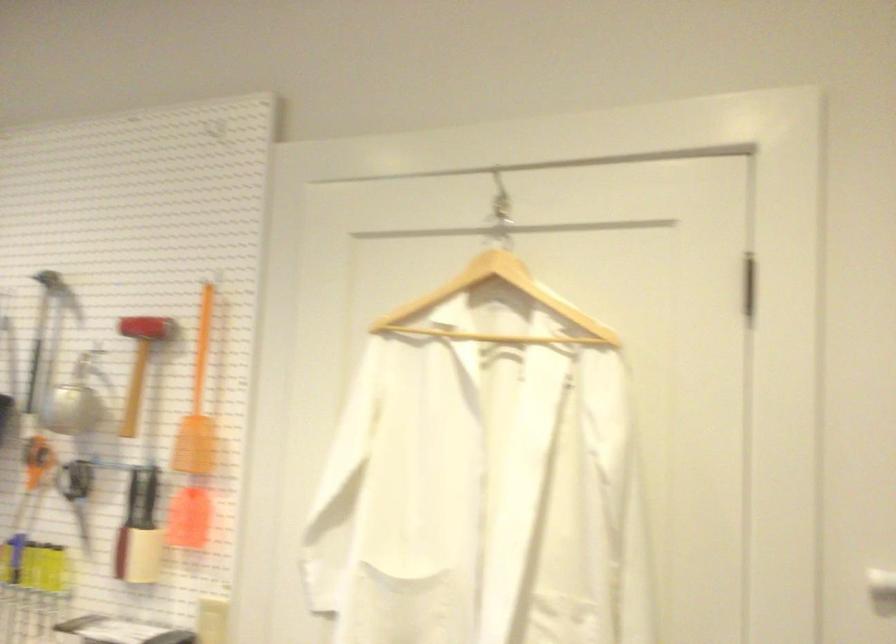
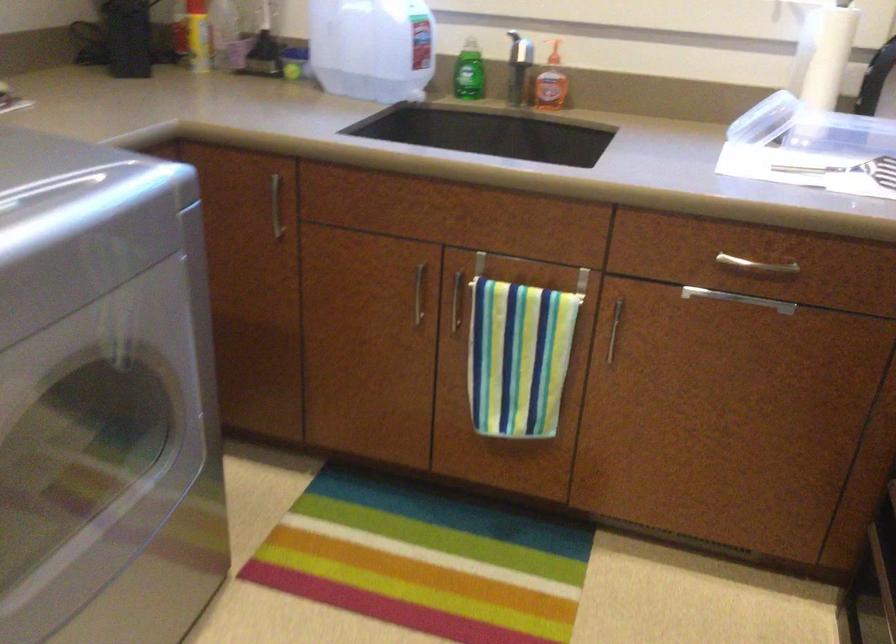
The images are taken continuously from a first-person perspective. In which direction is your viewpoint rotating?

The rotation direction of the camera is left-down.